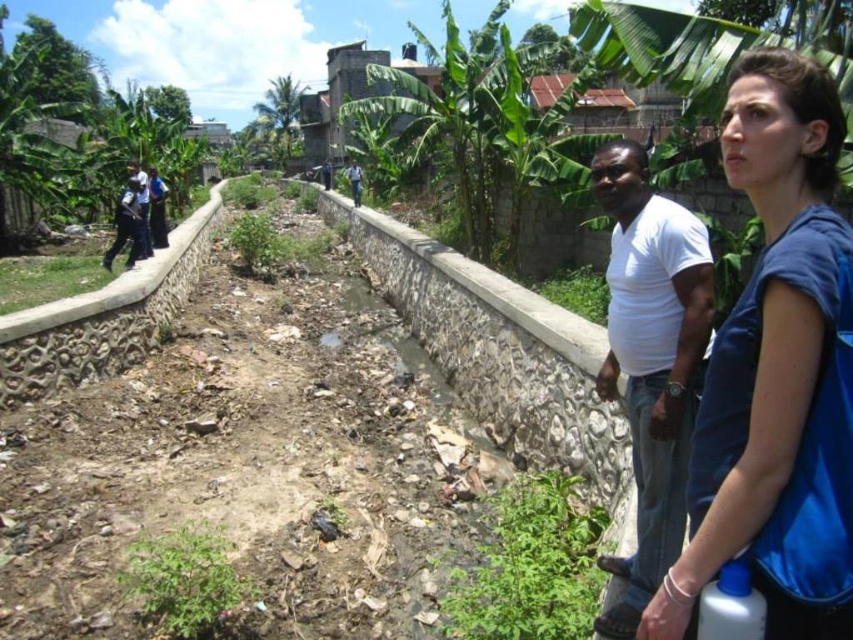
Question: Which point is closer to the camera taking this photo?

Choices:
 (A) (639, 340)
 (B) (786, 579)
 (C) (357, 202)
 (D) (146, 248)

Answer: (B)

Question: Can you confirm if blue fabric bag at center right is positioned to the left of white cotton shirt at center?

Choices:
 (A) yes
 (B) no

Answer: (B)

Question: Can you confirm if blue fabric bag at center right is bigger than white matte shirt at center?

Choices:
 (A) yes
 (B) no

Answer: (A)

Question: Which of the following is the farthest from the observer?

Choices:
 (A) dark blue shirt at center
 (B) white cotton shirt at center
 (C) dark blue uniform at upper left

Answer: (A)

Question: Among these objects, which one is farthest from the camera?

Choices:
 (A) white cotton shirt at center
 (B) dark blue uniform at upper left

Answer: (A)

Question: Is dark blue uniform at upper left below dark blue shirt at center?

Choices:
 (A) no
 (B) yes

Answer: (B)